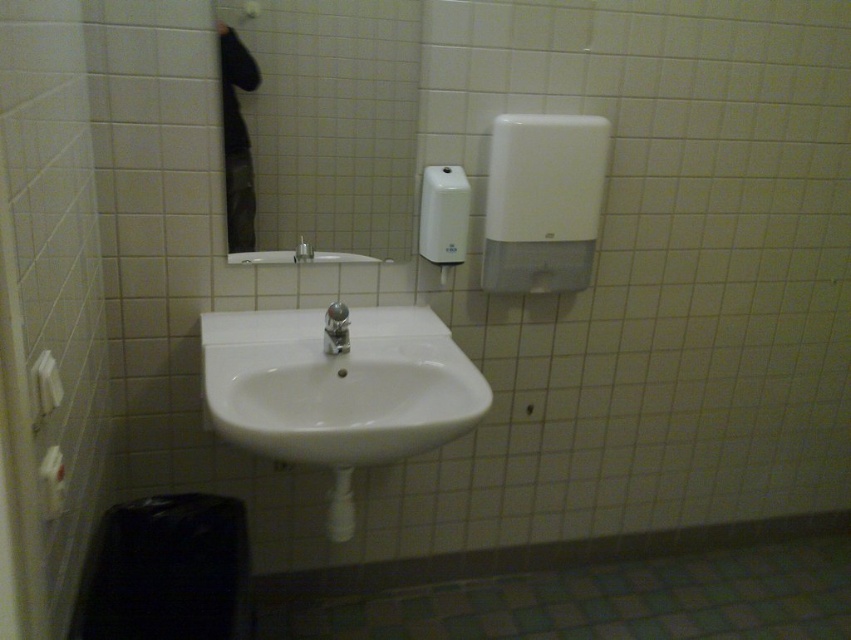
Question: Which object is the closest to the white plastic hand dryer at upper right?

Choices:
 (A) white plastic soap dispenser at upper center
 (B) white glossy mirror at upper center
 (C) white glossy sink at center
 (D) matte silver faucet at center

Answer: (A)

Question: From the image, what is the correct spatial relationship of white glossy sink at center in relation to satin chrome faucet at center?

Choices:
 (A) right
 (B) left

Answer: (A)

Question: Among these points, which one is farthest from the camera?

Choices:
 (A) (466, 184)
 (B) (341, 301)

Answer: (B)

Question: From the image, what is the correct spatial relationship of satin chrome faucet at center in relation to matte silver faucet at center?

Choices:
 (A) above
 (B) below

Answer: (B)

Question: Which of these objects is positioned closest to the white glossy sink at center?

Choices:
 (A) matte silver faucet at center
 (B) satin chrome faucet at center

Answer: (B)

Question: Is white glossy sink at center in front of white plastic hand dryer at upper right?

Choices:
 (A) yes
 (B) no

Answer: (A)